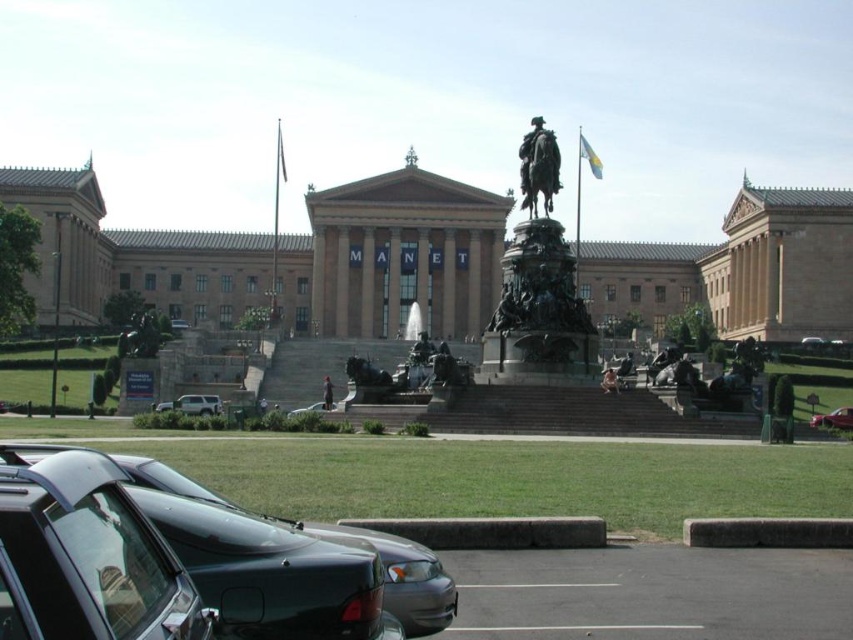
Question: Which point is closer to the camera taking this photo?

Choices:
 (A) (x=283, y=163)
 (B) (x=187, y=394)
 (C) (x=851, y=412)
 (D) (x=585, y=320)

Answer: (D)

Question: Does bronze statue at center lie behind metallic silver car at lower right?

Choices:
 (A) no
 (B) yes

Answer: (A)

Question: Among these points, which one is nearest to the camera?

Choices:
 (A) click(x=212, y=406)
 (B) click(x=526, y=307)
 (C) click(x=553, y=173)

Answer: (B)

Question: Is shiny black sedan at lower left wider than metallic silver car at center?

Choices:
 (A) no
 (B) yes

Answer: (B)

Question: Can you confirm if bronze statue at center is positioned above green fabric flag at upper center?

Choices:
 (A) yes
 (B) no

Answer: (B)

Question: Which object is the closest to the polished bronze statue at center?

Choices:
 (A) white fabric flag at upper center
 (B) satin silver suv at lower left
 (C) shiny black sedan at lower left

Answer: (B)